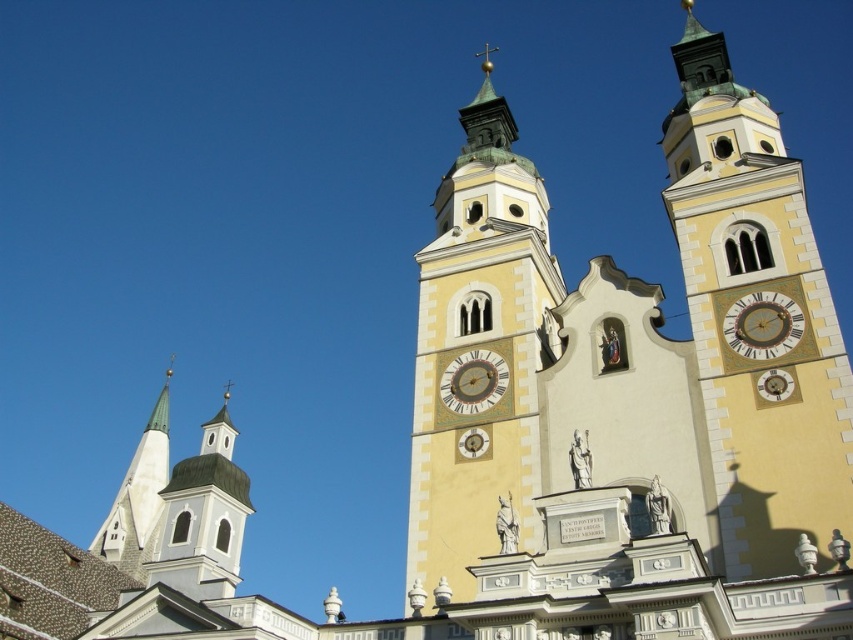
Question: Among these objects, which one is nearest to the camera?

Choices:
 (A) yellow painted stone clock tower at right
 (B) gold/brass clock at right
 (C) yellow stone clock tower at center
 (D) gold metallic clock at center

Answer: (C)

Question: Is yellow painted stone clock tower at right thinner than gold/brass clock at right?

Choices:
 (A) yes
 (B) no

Answer: (B)

Question: Which of these objects is positioned farthest from the gold metallic clock at center?

Choices:
 (A) yellow stone clock tower at center
 (B) yellow painted stone clock tower at right
 (C) gold/brass clock at right

Answer: (C)

Question: Is yellow painted stone clock tower at right thinner than gold/brass clock at right?

Choices:
 (A) no
 (B) yes

Answer: (A)

Question: Which of the following is the closest to the observer?

Choices:
 (A) (502, 392)
 (B) (518, 445)

Answer: (B)

Question: Does gold/brass clock at right have a smaller size compared to gold metallic clock at center?

Choices:
 (A) no
 (B) yes

Answer: (B)